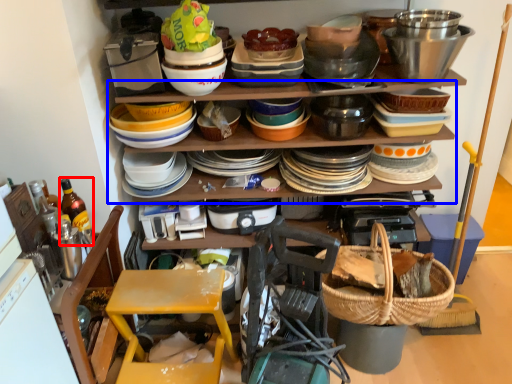
Question: Which object appears closest to the camera in this image, bottle (highlighted by a red box) or shelf (highlighted by a blue box)?

Choices:
 (A) bottle
 (B) shelf

Answer: (A)